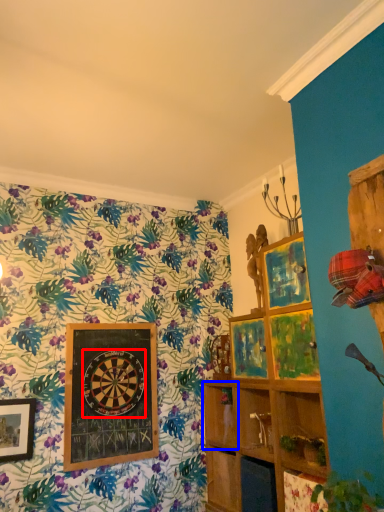
Question: Which point is further to the camera, design (highlighted by a red box) or shelf (highlighted by a blue box)?

Choices:
 (A) design
 (B) shelf

Answer: (B)